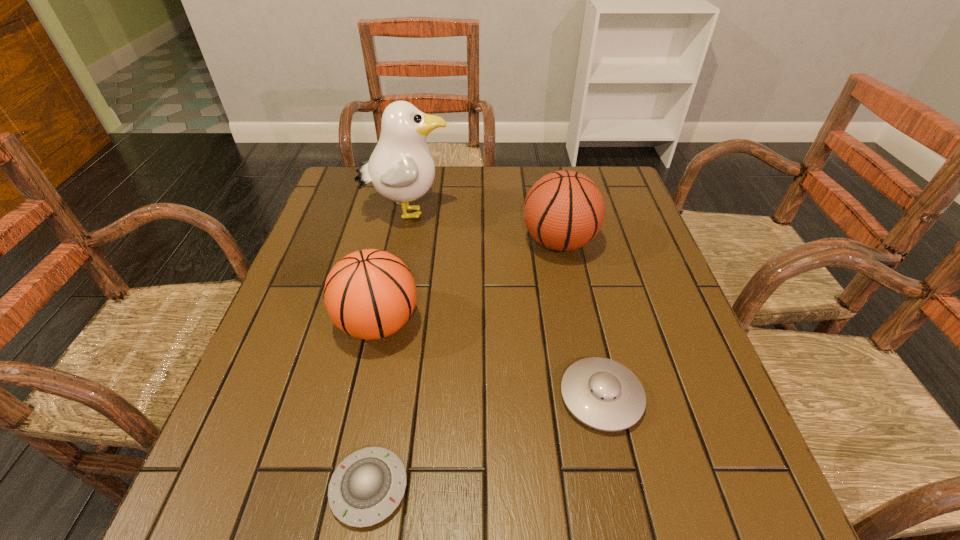
Find the location of a particular element. The width and height of the screenshot is (960, 540). free spot that satisfies the following two spatial constraints: 1. on the beak of the tallest object; 2. on the right side of the left saucer is located at coordinates 351,488.

Where is `free space in the image that satisfies the following two spatial constraints: 1. on the beak of the shorter saucer; 2. on the right side of the tallest object`? This screenshot has height=540, width=960. free space in the image that satisfies the following two spatial constraints: 1. on the beak of the shorter saucer; 2. on the right side of the tallest object is located at coordinates (351, 488).

Identify the location of free location that satisfies the following two spatial constraints: 1. on the beak of the tallest object; 2. on the left side of the shortest object. (351, 488).

You are a GUI agent. You are given a task and a screenshot of the screen. Output one action in this format:
    pyautogui.click(x=<x>, y=<y>)
    Task: Click on the vacant position in the image that satisfies the following two spatial constraints: 1. on the back side of the fourth farthest object; 2. on the side where the inflation valve is located
    
    Given the screenshot: What is the action you would take?
    pyautogui.click(x=567, y=242)

Identify the location of vacant position in the image that satisfies the following two spatial constraints: 1. on the front side of the nearer basketball; 2. on the left side of the fourth farthest object. (362, 397).

What are the coordinates of `vacant space that satisfies the following two spatial constraints: 1. on the beak of the nearest object; 2. on the left side of the tallest object` in the screenshot? It's located at (351, 488).